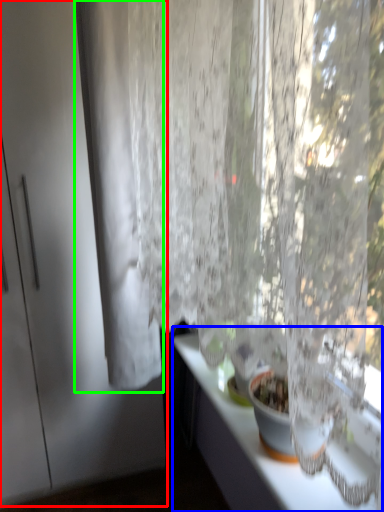
Question: Estimate the real-world distances between objects in this image. Which object is farther from screen door (highlighted by a red box), counter top (highlighted by a blue box) or curtain (highlighted by a green box)?

Choices:
 (A) counter top
 (B) curtain

Answer: (A)